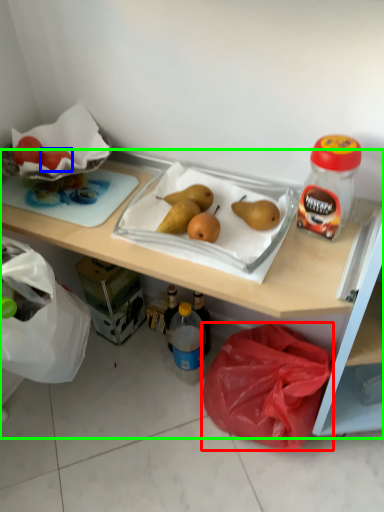
Question: Which object is positioned farthest from plastic bag (highlighted by a red box)? Select from grapefruit (highlighted by a blue box) and desk (highlighted by a green box).

Choices:
 (A) grapefruit
 (B) desk

Answer: (A)